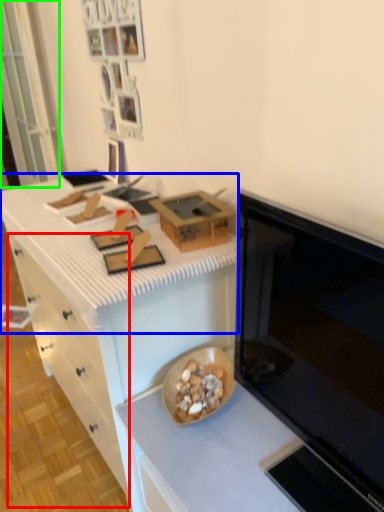
Question: Which object is the closest to the drawer (highlighted by a red box)? Choose among these: countertop (highlighted by a blue box) or glass door (highlighted by a green box).

Choices:
 (A) countertop
 (B) glass door

Answer: (A)